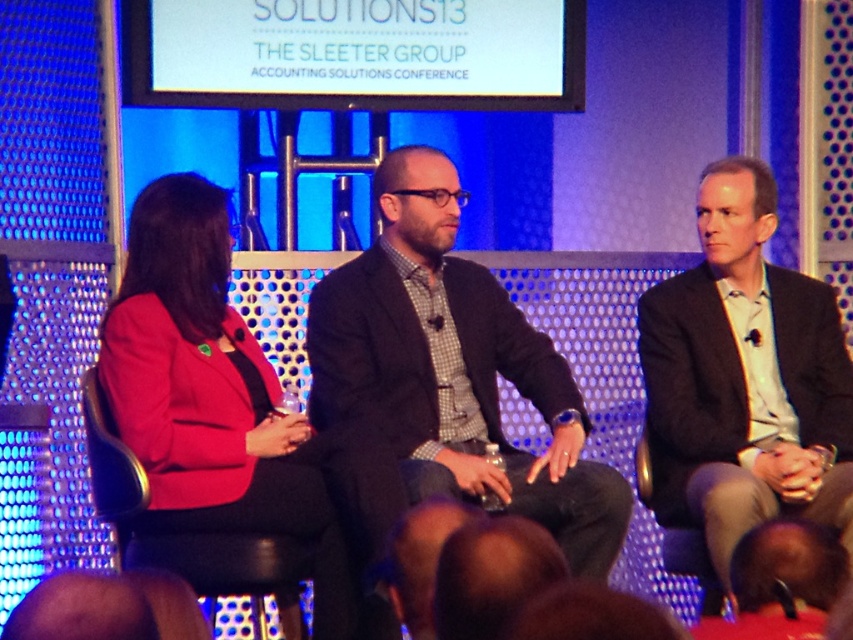
Question: Which point appears closest to the camera in this image?

Choices:
 (A) (671, 508)
 (B) (711, 611)
 (C) (541, 484)
 (D) (244, 332)

Answer: (D)

Question: Is light brown suit at right to the left of matte red blazer at center from the viewer's perspective?

Choices:
 (A) yes
 (B) no

Answer: (B)

Question: Which point appears farthest from the camera in this image?

Choices:
 (A) (263, 634)
 (B) (668, 532)

Answer: (A)

Question: Which point appears farthest from the camera in this image?

Choices:
 (A) (430, 388)
 (B) (724, 516)
 (C) (86, 422)
 (D) (692, 534)

Answer: (A)

Question: Is light brown suit at right below matte red blazer at center?

Choices:
 (A) yes
 (B) no

Answer: (B)

Question: In this image, where is matte red blazer at center located relative to black leather chair at left?

Choices:
 (A) left
 (B) right

Answer: (B)